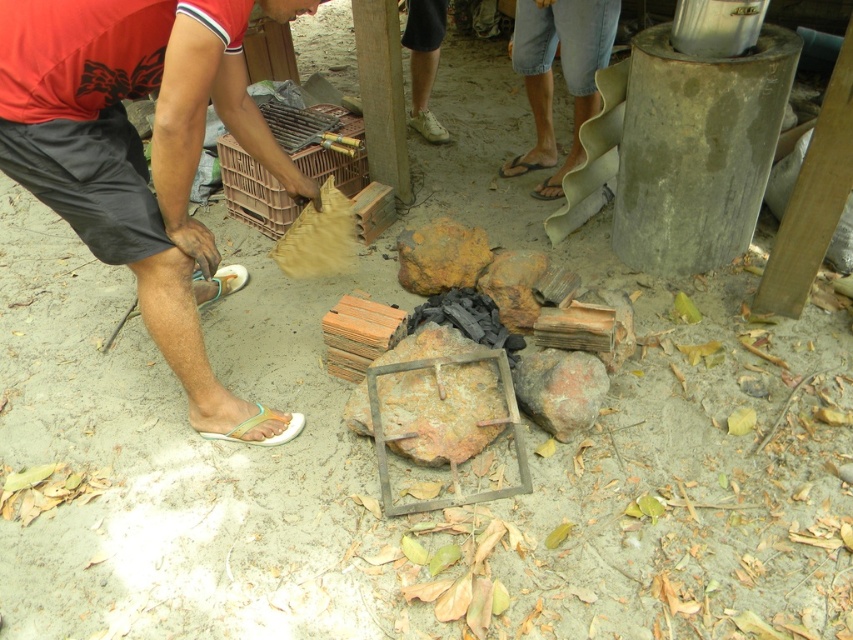
You are a construction worker who needs to place a tool on the ground. You have two options for placement spots near the matte black sandal at lower left and the rusty metal rock at center. Which spot has a wider surface area?

The matte black sandal at lower left has a wider surface area than the rusty metal rock at center because the matte black sandal at lower left is wider than the rusty metal rock at center.

You are standing in the outdoor scene and need to place a small object between the matte black sandal at lower left and the rusty metal rock at center. Based on their positions, which object should you place it closer to?

The matte black sandal at lower left is to the left of the rusty metal rock at center, so placing the small object closer to the rusty metal rock at center would keep it between them.

You are standing in the outdoor scene and need to locate the matte black sandal at lower left and the blue denim shorts at upper right. Which object is positioned more to the left side of the scene?

The matte black sandal at lower left is positioned more to the left side of the scene than the blue denim shorts at upper right.